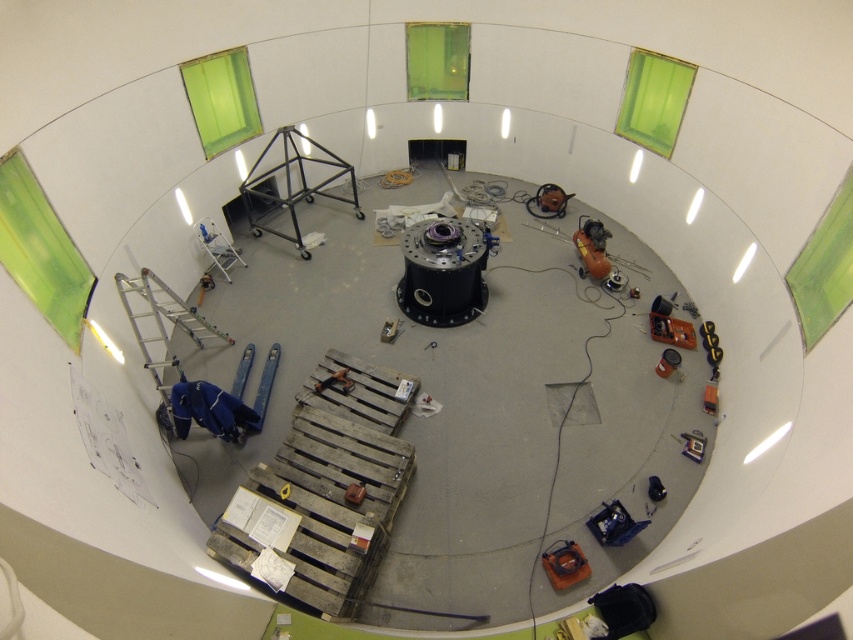
Which is more to the right, metallic blue ladder at left or matte black helmet at center?

Positioned to the right is matte black helmet at center.

Identify the location of metallic blue ladder at left. (216, 246).

Identify the location of metallic blue ladder at left. (216, 246).

Image resolution: width=853 pixels, height=640 pixels. In order to click on metallic blue ladder at left in this screenshot , I will do `click(216, 246)`.

What are the coordinates of `metallic robotic arm at right` in the screenshot? It's located at (592, 248).

Image resolution: width=853 pixels, height=640 pixels. In order to click on metallic robotic arm at right in this screenshot , I will do `click(592, 248)`.

In order to click on orange rubber hose at lower right in this screenshot , I will do `click(564, 563)`.

Can you confirm if orange rubber hose at lower right is positioned to the right of matte black helmet at center?

In fact, orange rubber hose at lower right is to the left of matte black helmet at center.

Where is `orange rubber hose at lower right`? The image size is (853, 640). orange rubber hose at lower right is located at coordinates (564, 563).